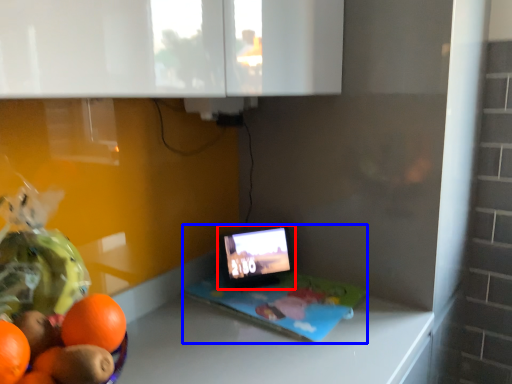
Question: Which point is closer to the camera, tablet computer (highlighted by a red box) or laptop (highlighted by a blue box)?

Choices:
 (A) tablet computer
 (B) laptop

Answer: (B)